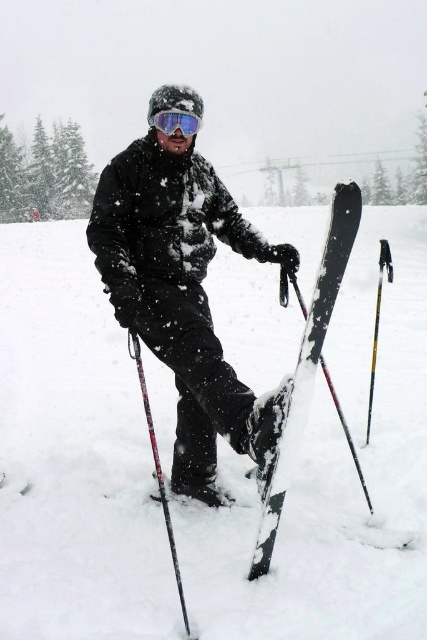
What do you see at coordinates (181, 292) in the screenshot? The height and width of the screenshot is (640, 427). I see `matte black snowboard at center` at bounding box center [181, 292].

Who is positioned more to the right, matte black snowboard at center or black textured ski pole at lower left?

matte black snowboard at center is more to the right.

Locate an element on the screen. Image resolution: width=427 pixels, height=640 pixels. matte black snowboard at center is located at coordinates (181, 292).

Between point (315, 340) and point (169, 131), which one is positioned behind?

Positioned behind is point (169, 131).

What do you see at coordinates (310, 365) in the screenshot?
I see `black matte ski at center` at bounding box center [310, 365].

Identify the location of black matte ski at center. The image size is (427, 640). (310, 365).

Does black matte ski at center appear on the left side of black textured ski pole at lower left?

Incorrect, black matte ski at center is not on the left side of black textured ski pole at lower left.

Which of these two, black matte ski at center or black textured ski pole at lower left, stands taller?

black matte ski at center

The height and width of the screenshot is (640, 427). What are the coordinates of `black matte ski at center` in the screenshot? It's located at (310, 365).